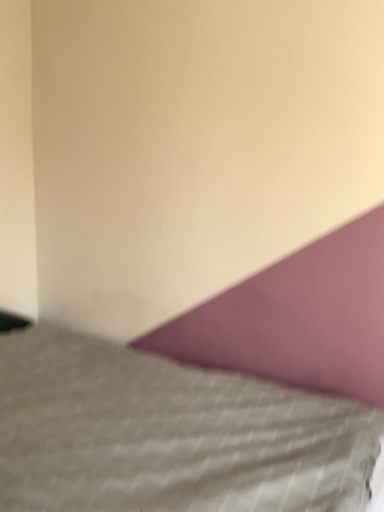
The height and width of the screenshot is (512, 384). What do you see at coordinates (210, 397) in the screenshot? I see `matte gray bed at center` at bounding box center [210, 397].

Locate an element on the screen. Image resolution: width=384 pixels, height=512 pixels. matte gray bed at center is located at coordinates (210, 397).

In the scene shown: Measure the distance between matte gray bed at center and camera.

The distance of matte gray bed at center from camera is 1.20 meters.

Where is `matte gray bed at center`? matte gray bed at center is located at coordinates (210, 397).